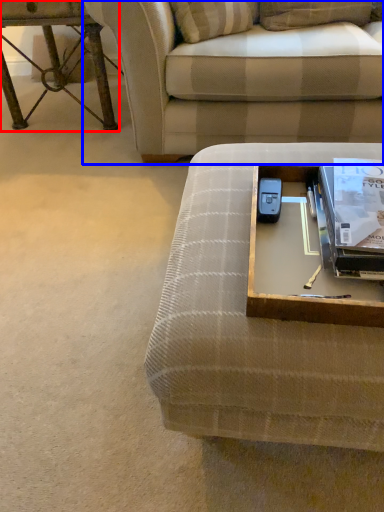
Question: Which point is closer to the camera, table (highlighted by a red box) or studio couch (highlighted by a blue box)?

Choices:
 (A) table
 (B) studio couch

Answer: (B)